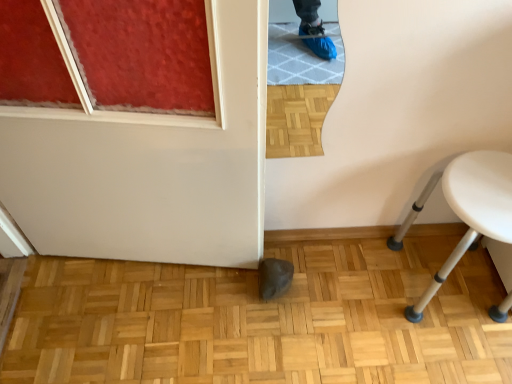
Question: Is natural wood parquet floor at center outside of white glossy door at lower center?

Choices:
 (A) yes
 (B) no

Answer: (A)

Question: Considering the relative positions of natural wood parquet floor at center and white glossy door at lower center in the image provided, is natural wood parquet floor at center behind white glossy door at lower center?

Choices:
 (A) no
 (B) yes

Answer: (B)

Question: Is natural wood parquet floor at center looking in the opposite direction of white glossy door at lower center?

Choices:
 (A) no
 (B) yes

Answer: (A)

Question: Does natural wood parquet floor at center have a greater width compared to white glossy door at lower center?

Choices:
 (A) no
 (B) yes

Answer: (B)

Question: Could you tell me if natural wood parquet floor at center is facing white glossy door at lower center?

Choices:
 (A) yes
 (B) no

Answer: (B)

Question: From a real-world perspective, relative to white glossy door at lower center, is white plastic stool at lower right vertically above or below?

Choices:
 (A) below
 (B) above

Answer: (A)

Question: Is white plastic stool at lower right to the left or to the right of white glossy door at lower center in the image?

Choices:
 (A) right
 (B) left

Answer: (A)

Question: In terms of height, does white plastic stool at lower right look taller or shorter compared to white glossy door at lower center?

Choices:
 (A) short
 (B) tall

Answer: (A)

Question: Is white plastic stool at lower right situated inside white glossy door at lower center or outside?

Choices:
 (A) outside
 (B) inside

Answer: (A)

Question: From their relative heights in the image, would you say natural wood parquet floor at center is taller or shorter than white plastic stool at lower right?

Choices:
 (A) short
 (B) tall

Answer: (A)

Question: Which is correct: natural wood parquet floor at center is inside white plastic stool at lower right, or outside of it?

Choices:
 (A) outside
 (B) inside

Answer: (A)

Question: Is point (162, 352) closer or farther from the camera than point (426, 299)?

Choices:
 (A) farther
 (B) closer

Answer: (B)

Question: From a real-world perspective, is natural wood parquet floor at center above or below white plastic stool at lower right?

Choices:
 (A) below
 (B) above

Answer: (A)

Question: In terms of width, does white glossy door at lower center look wider or thinner when compared to natural wood parquet floor at center?

Choices:
 (A) wide
 (B) thin

Answer: (B)

Question: From the image's perspective, relative to natural wood parquet floor at center, is white glossy door at lower center above or below?

Choices:
 (A) above
 (B) below

Answer: (A)